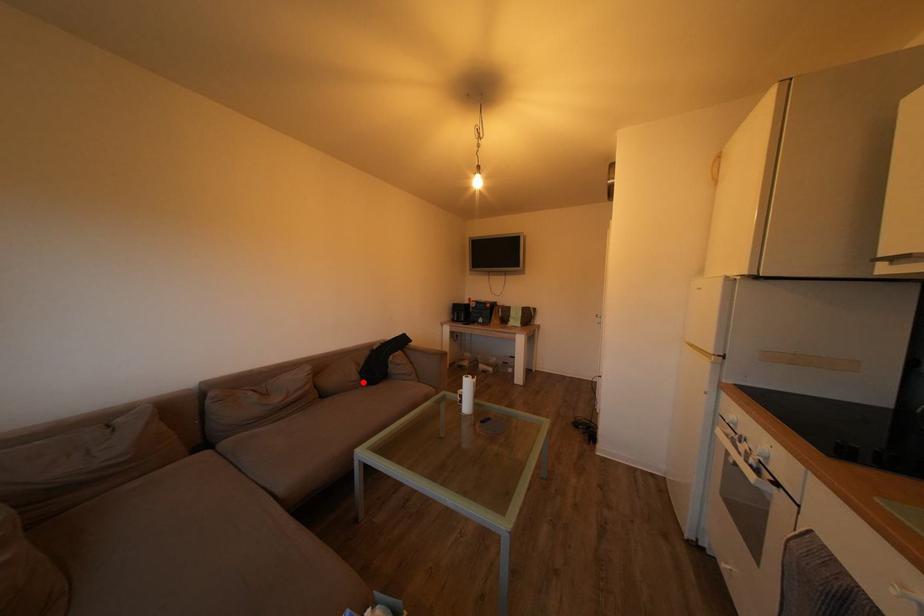
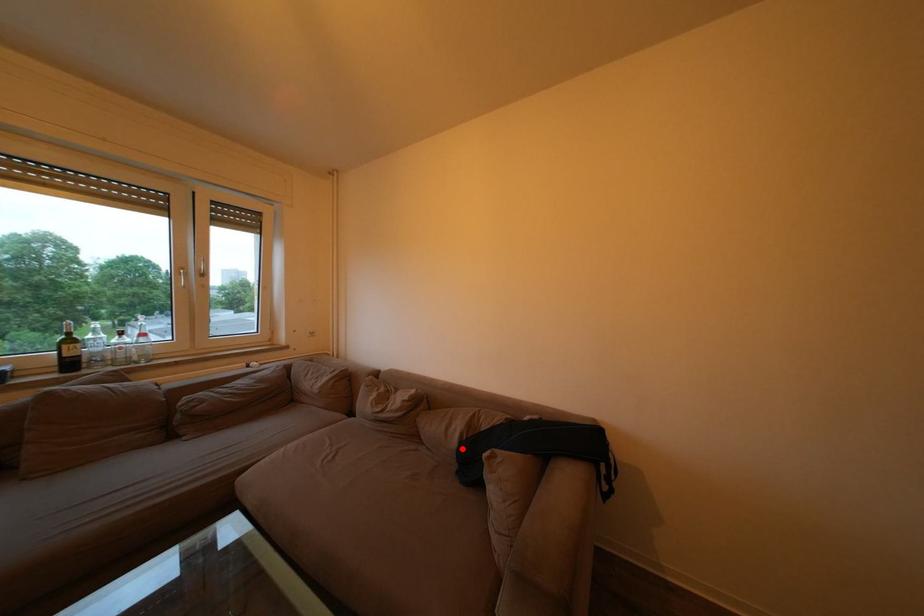
I am providing you with two images of the same scene from different viewpoints. A red point is marked on the first image and another point is marked on the second image. Is the red point in image1 aligned with the point shown in image2?

Yes